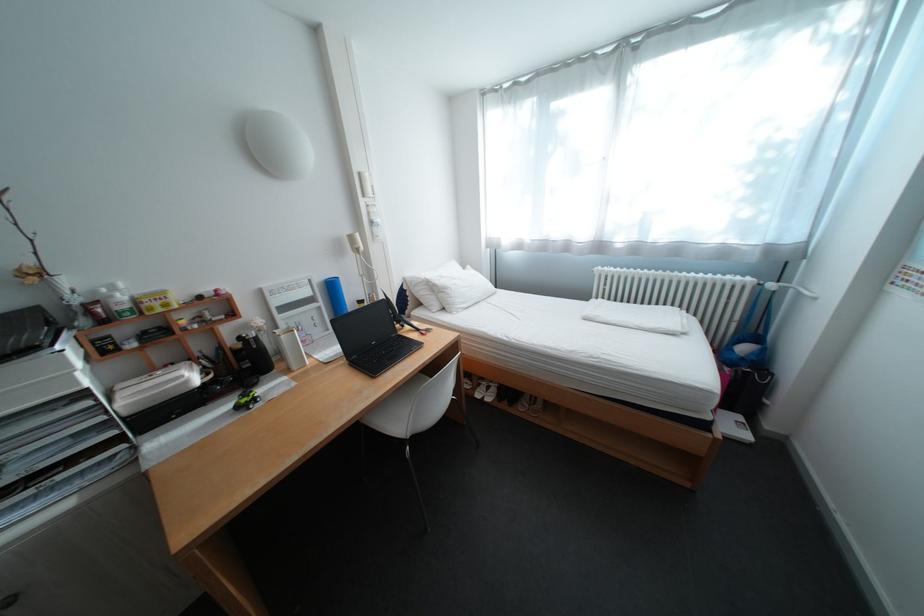
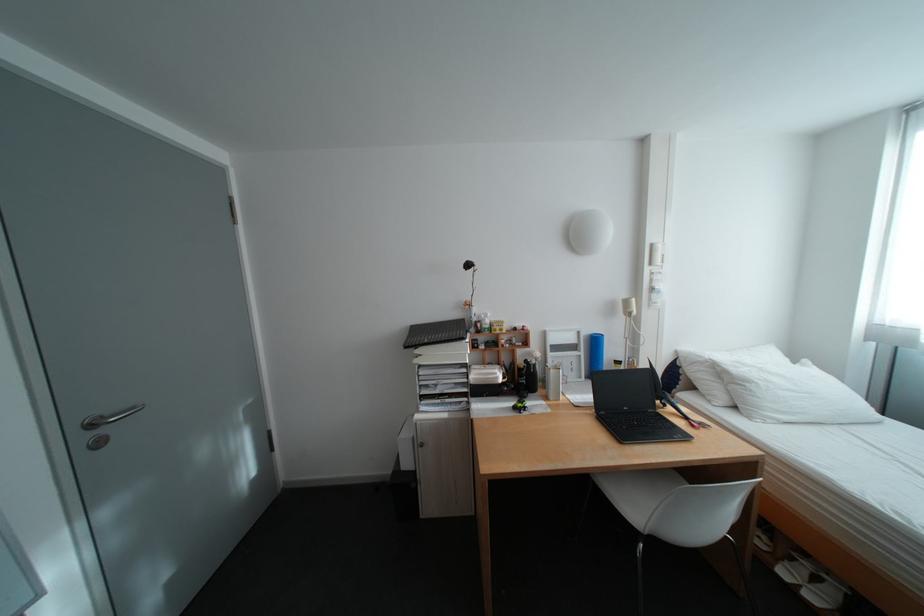
Where in the second image is the point corresponding to pixel 459 290 from the first image?

(761, 384)